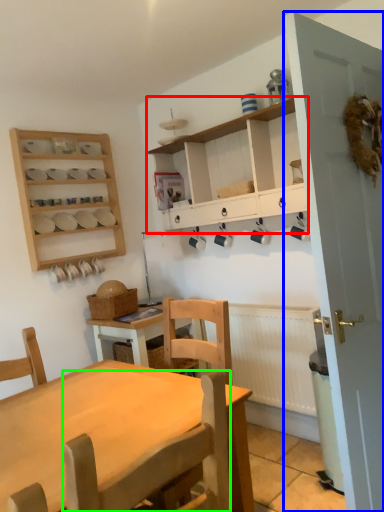
Question: Estimate the real-world distances between objects in this image. Which object is farther from cabinetry (highlighted by a red box), door (highlighted by a blue box) or chair (highlighted by a green box)?

Choices:
 (A) door
 (B) chair

Answer: (B)